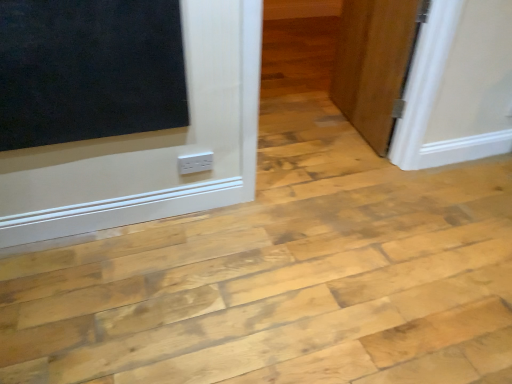
What do you see at coordinates (195, 162) in the screenshot? The image size is (512, 384). I see `white plastic electric outlet at lower center` at bounding box center [195, 162].

What is the approximate height of white plastic electric outlet at lower center?

white plastic electric outlet at lower center is 4.06 inches in height.

What are the coordinates of `white plastic electric outlet at lower center` in the screenshot? It's located at (195, 162).

What do you see at coordinates (373, 64) in the screenshot? This screenshot has height=384, width=512. I see `wooden door at right` at bounding box center [373, 64].

Where is `wooden door at right`? wooden door at right is located at coordinates tap(373, 64).

Measure the distance between wooden door at right and camera.

wooden door at right and camera are 1.94 meters apart.

Identify the location of white plastic electric outlet at lower center. (195, 162).

Visually, is white plastic electric outlet at lower center positioned to the left or to the right of wooden door at right?

In the image, white plastic electric outlet at lower center appears on the left side of wooden door at right.

Does white plastic electric outlet at lower center come in front of wooden door at right?

Yes, it is in front of wooden door at right.

Which point is more forward, (197, 161) or (391, 119)?

Point (197, 161)

Consider the image. From the image's perspective, does white plastic electric outlet at lower center appear higher than wooden door at right?

No, from the image's perspective, white plastic electric outlet at lower center is not over wooden door at right.

From a real-world perspective, between white plastic electric outlet at lower center and wooden door at right, who is vertically lower?

In real-world perspective, white plastic electric outlet at lower center is lower.

Which of these two, white plastic electric outlet at lower center or wooden door at right, is wider?

Wider between the two is wooden door at right.

Which of these two, white plastic electric outlet at lower center or wooden door at right, stands taller?

wooden door at right.

Considering the relative sizes of white plastic electric outlet at lower center and wooden door at right in the image provided, is white plastic electric outlet at lower center smaller than wooden door at right?

Correct, white plastic electric outlet at lower center occupies less space than wooden door at right.

Is white plastic electric outlet at lower center inside the boundaries of wooden door at right, or outside?

white plastic electric outlet at lower center is not enclosed by wooden door at right.

Is white plastic electric outlet at lower center directly adjacent to wooden door at right?

No, white plastic electric outlet at lower center is not making contact with wooden door at right.

Is white plastic electric outlet at lower center turned away from wooden door at right?

white plastic electric outlet at lower center does not have its back to wooden door at right.

How many degrees apart are the facing directions of white plastic electric outlet at lower center and wooden door at right?

The angular difference between white plastic electric outlet at lower center and wooden door at right is 5.96 degrees.

How far apart are white plastic electric outlet at lower center and wooden door at right?

A distance of 1.18 meters exists between white plastic electric outlet at lower center and wooden door at right.

At what (x,y) coordinates should I click in order to perform the action: click on door located above the white plastic electric outlet at lower center (from the image's perspective). Please return your answer as a coordinate pair (x, y). The width and height of the screenshot is (512, 384). Looking at the image, I should click on (373, 64).

Does wooden door at right appear on the right side of white plastic electric outlet at lower center?

Indeed, wooden door at right is positioned on the right side of white plastic electric outlet at lower center.

Is wooden door at right closer to the viewer compared to white plastic electric outlet at lower center?

No.

Does point (353, 110) come in front of point (190, 165)?

No.

From the image's perspective, is wooden door at right above white plastic electric outlet at lower center?

Correct, wooden door at right appears higher than white plastic electric outlet at lower center in the image.

From a real-world perspective, is wooden door at right positioned above or below white plastic electric outlet at lower center?

From a real-world perspective, wooden door at right is physically above white plastic electric outlet at lower center.

Considering the relative sizes of wooden door at right and white plastic electric outlet at lower center in the image provided, is wooden door at right thinner than white plastic electric outlet at lower center?

No.

Between wooden door at right and white plastic electric outlet at lower center, which one has less height?

white plastic electric outlet at lower center is shorter.

Does wooden door at right have a larger size compared to white plastic electric outlet at lower center?

Indeed, wooden door at right has a larger size compared to white plastic electric outlet at lower center.

Is wooden door at right completely or partially outside of white plastic electric outlet at lower center?

Yes, wooden door at right is outside of white plastic electric outlet at lower center.

Is wooden door at right far from white plastic electric outlet at lower center?

Yes, wooden door at right and white plastic electric outlet at lower center are quite far apart.

Is wooden door at right positioned with its back to white plastic electric outlet at lower center?

No, wooden door at right is not facing away from white plastic electric outlet at lower center.

How different are the orientations of wooden door at right and white plastic electric outlet at lower center in degrees?

There is a 5.96-degree angle between the facing directions of wooden door at right and white plastic electric outlet at lower center.

How much distance is there between wooden door at right and white plastic electric outlet at lower center?

A distance of 3.87 feet exists between wooden door at right and white plastic electric outlet at lower center.

Locate an element on the screen. door that is behind the white plastic electric outlet at lower center is located at coordinates (373, 64).

In order to click on door above the white plastic electric outlet at lower center (from the image's perspective) in this screenshot , I will do `click(373, 64)`.

Identify the location of electric outlet lying on the left of wooden door at right. (195, 162).